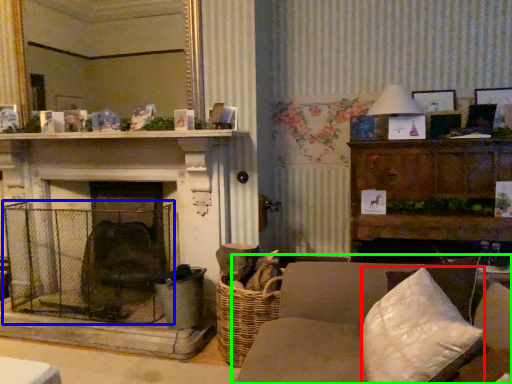
Question: Which object is the farthest from pillow (highlighted by a red box)? Choose among these: cage (highlighted by a blue box) or studio couch (highlighted by a green box).

Choices:
 (A) cage
 (B) studio couch

Answer: (A)